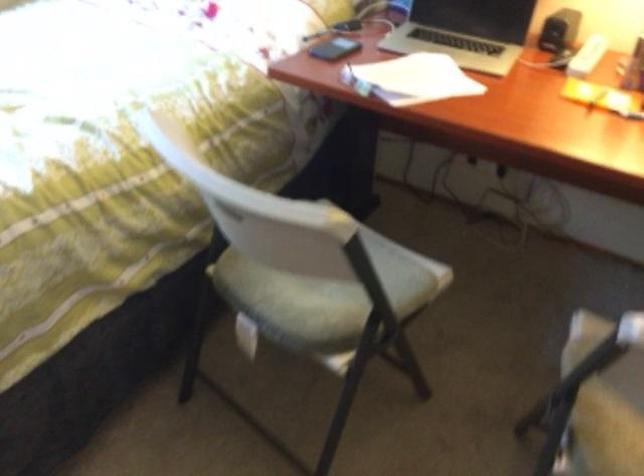
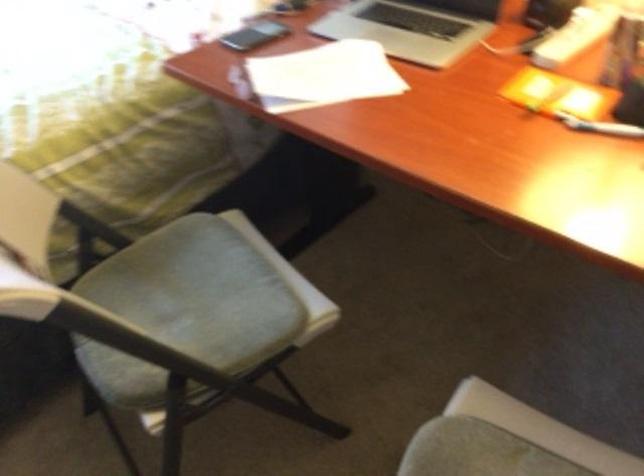
Question: Based on the continuous images, in which direction is the camera rotating? Reply with the corresponding letter.

Choices:
 (A) Left
 (B) Right
 (C) Up
 (D) Down

Answer: (A)